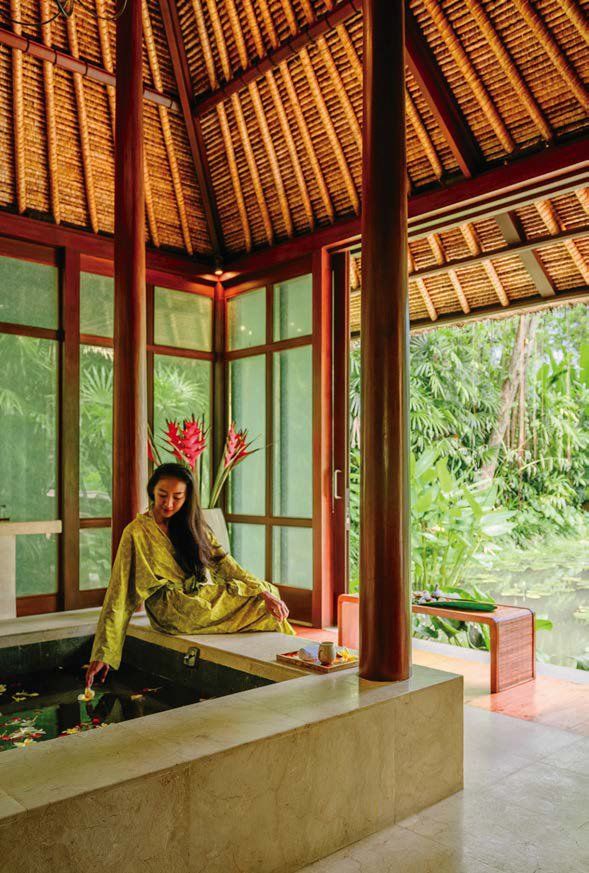
At what (x,y) coordinates should I click in order to perform the action: click on giant flower pot. Please return your answer as a coordinate pair (x, y). The image size is (589, 873). Looking at the image, I should click on (214, 520), (221, 538).